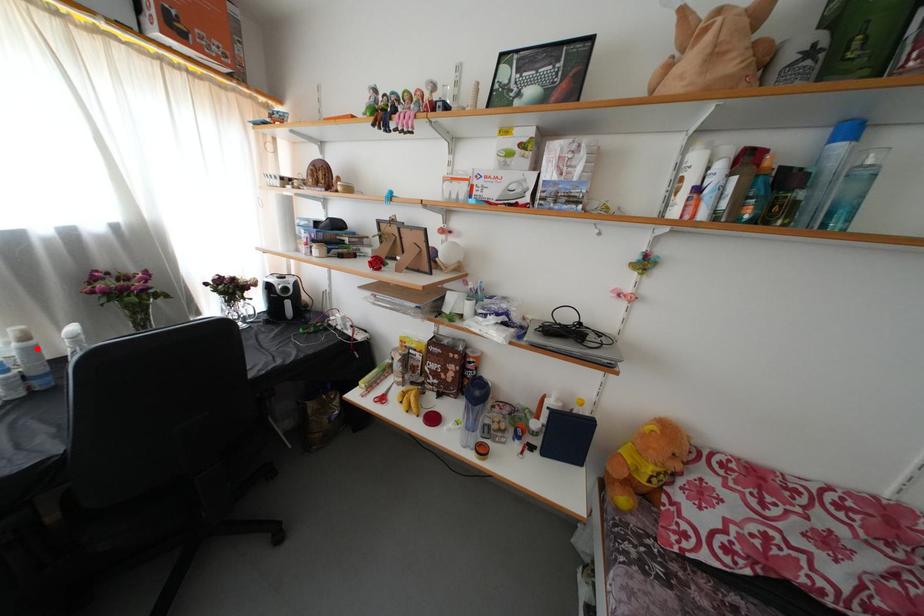
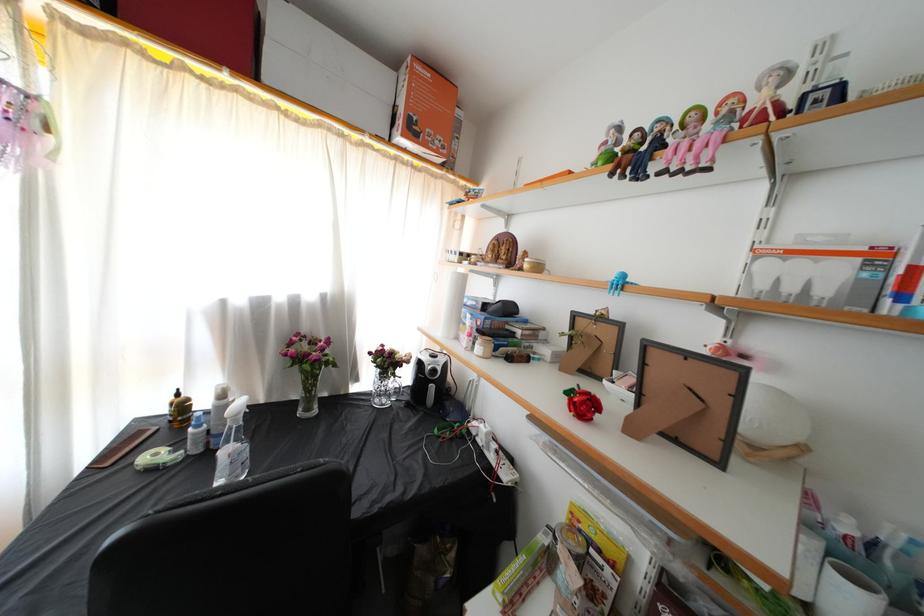
Question: I am providing you with two images of the same scene from different viewpoints. Image1 has a red point marked. In image2, the corresponding 3D location appears at what relative position? Reply with the corresponding letter.

Choices:
 (A) Closer
 (B) Farther

Answer: (A)